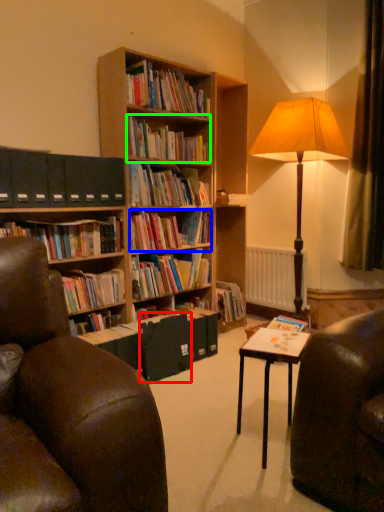
Question: Estimate the real-world distances between objects in this image. Which object is closer to paperback book (highlighted by a red box), book (highlighted by a blue box) or book (highlighted by a green box)?

Choices:
 (A) book
 (B) book

Answer: (A)